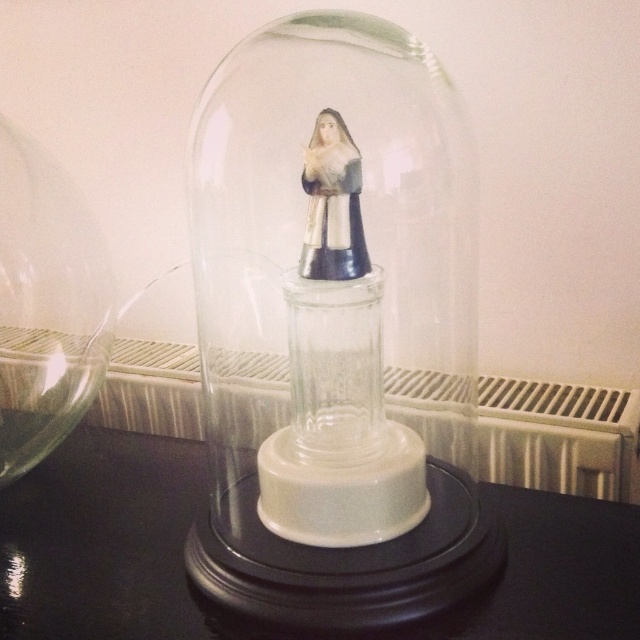
Question: Which object is farther from the camera taking this photo?

Choices:
 (A) white textured radiator at center
 (B) black glossy table at center
 (C) transparent glass dome at center
 (D) transparent glass vase at left

Answer: (A)

Question: Is white textured radiator at center positioned in front of matte silver statue at center?

Choices:
 (A) no
 (B) yes

Answer: (A)

Question: Does transparent glass dome at center have a greater width compared to matte silver statue at center?

Choices:
 (A) no
 (B) yes

Answer: (B)

Question: Which object is the farthest from the matte silver statue at center?

Choices:
 (A) transparent glass vase at left
 (B) white textured radiator at center
 (C) transparent glass dome at center

Answer: (A)

Question: Which of these objects is positioned farthest from the transparent glass dome at center?

Choices:
 (A) white textured radiator at center
 (B) transparent glass vase at left
 (C) matte silver statue at center

Answer: (B)

Question: Is the position of transparent glass dome at center more distant than that of transparent glass vase at left?

Choices:
 (A) no
 (B) yes

Answer: (A)